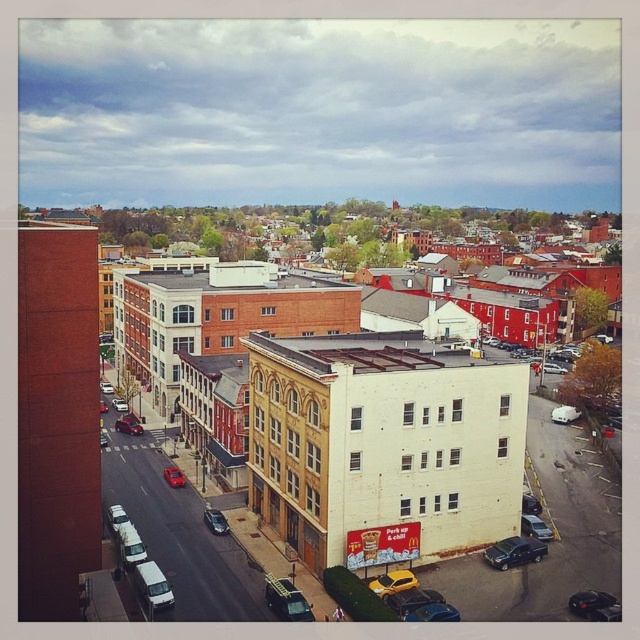
You are a delivery driver who needs to park your vehicle between the shiny black sedan at lower right and the yellow matte car at lower center. Your delivery van is 7 meters long. Is there enough space between the two cars to park your van?

The shiny black sedan at lower right is 13.60 meters away from the yellow matte car at lower center. Since your van is 7 meters long, there is sufficient space between the two cars to park your van.

You are standing on a balcony overlooking the street below. You see a shiny black sedan at lower right and a yellow matte car at lower center. Which car is positioned more to the right side of the street?

The shiny black sedan at lower right is positioned more to the right side of the street than the yellow matte car at lower center.

In the scene shown: You are a delivery driver who needs to park your vehicle in a narrow alley between the shiny black sedan at lower right and the yellow matte car at lower center. Your vehicle is 1.8 meters wide. Can you fit your vehicle between them?

The shiny black sedan at lower right is thinner than the yellow matte car at lower center. However, the width of the alley between them is not specified in the provided information, so it is impossible to determine if your vehicle can fit based on the given details.